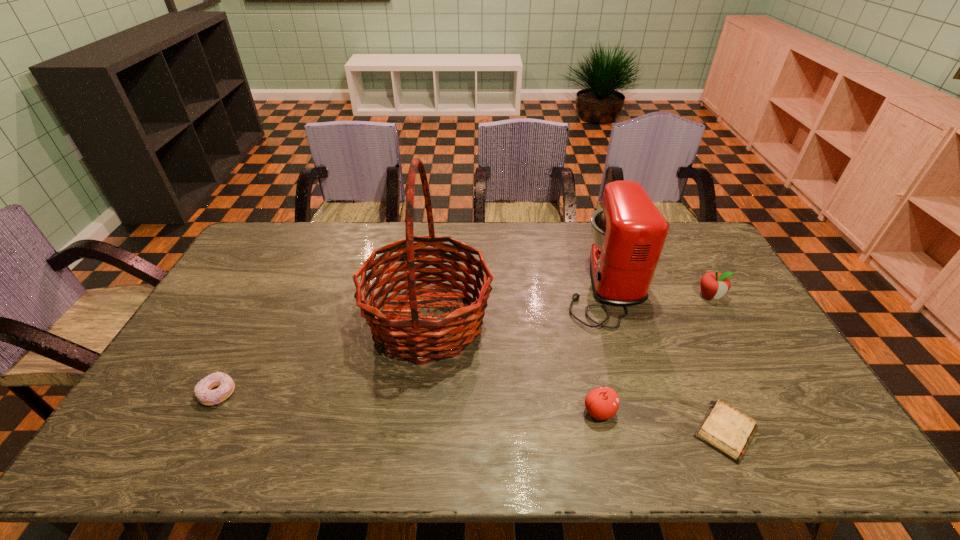
Locate an element on the screen. The width and height of the screenshot is (960, 540). empty space that is in between the second object from left to right and the shortest object is located at coordinates (577, 376).

At what (x,y) coordinates should I click in order to perform the action: click on free space between the second shortest object and the shorter apple. Please return your answer as a coordinate pair (x, y). Image resolution: width=960 pixels, height=540 pixels. Looking at the image, I should click on (409, 403).

Where is `free area in between the kitchen mixer and the tallest object`? free area in between the kitchen mixer and the tallest object is located at coordinates (516, 303).

Where is `free space that is in between the shortest object and the second object from left to right`? The height and width of the screenshot is (540, 960). free space that is in between the shortest object and the second object from left to right is located at coordinates (577, 376).

Locate an element on the screen. empty space between the second tallest object and the third tallest object is located at coordinates coord(657,290).

Where is `vacant area between the nearer apple and the doughnut`? vacant area between the nearer apple and the doughnut is located at coordinates (409, 403).

Where is `free space that is in between the diary and the second tallest object`? This screenshot has width=960, height=540. free space that is in between the diary and the second tallest object is located at coordinates (664, 358).

Identify the location of object that stands as the fourth closest to the tallest object. This screenshot has width=960, height=540. (727, 430).

This screenshot has width=960, height=540. In order to click on object that is the third closest one to the fourth tallest object in this screenshot , I will do `click(629, 232)`.

Find the location of a particular element. Image resolution: width=960 pixels, height=540 pixels. free spot that satisfies the following two spatial constraints: 1. on the back side of the tallest object; 2. on the left side of the rightmost object is located at coordinates (431, 295).